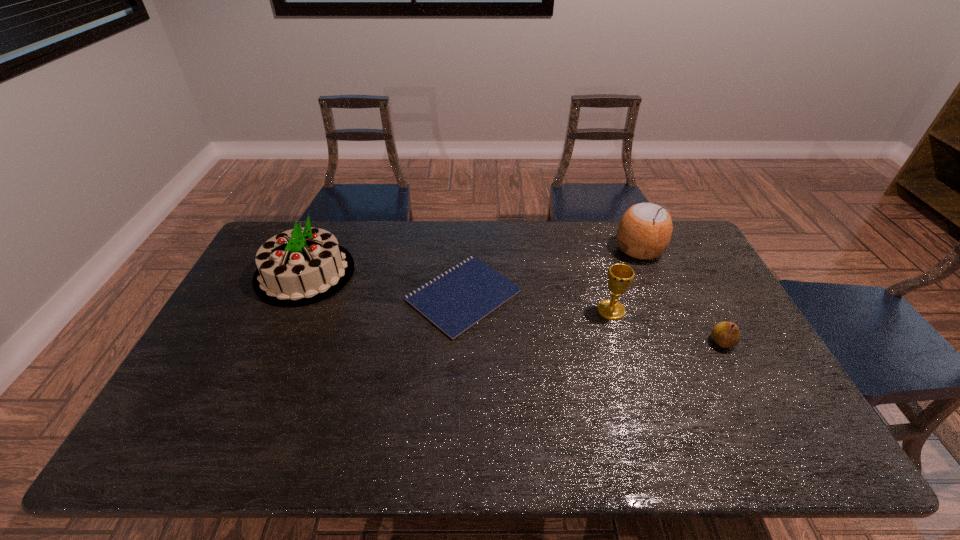
The width and height of the screenshot is (960, 540). I want to click on coconut, so click(x=644, y=232).

At what (x,y) coordinates should I click in order to perform the action: click on birthday cake. Please return your answer as a coordinate pair (x, y). Image resolution: width=960 pixels, height=540 pixels. Looking at the image, I should click on (302, 266).

Identify the location of the third shortest object. Image resolution: width=960 pixels, height=540 pixels. (620, 276).

This screenshot has height=540, width=960. What are the coordinates of `chalice` in the screenshot? It's located at (620, 276).

Identify the location of the second shortest object. (726, 334).

This screenshot has height=540, width=960. Find the location of `notepad`. notepad is located at coordinates pos(456,300).

The image size is (960, 540). In order to click on the second object from left to right in this screenshot , I will do `click(456, 300)`.

The image size is (960, 540). In order to click on vacant space located on the left of the coconut in this screenshot , I will do `click(509, 249)`.

This screenshot has height=540, width=960. What are the coordinates of `free point located 0.330m on the right of the birthday cake` in the screenshot? It's located at (453, 273).

Identify the location of vacant space located on the back of the third object from right to left. (604, 287).